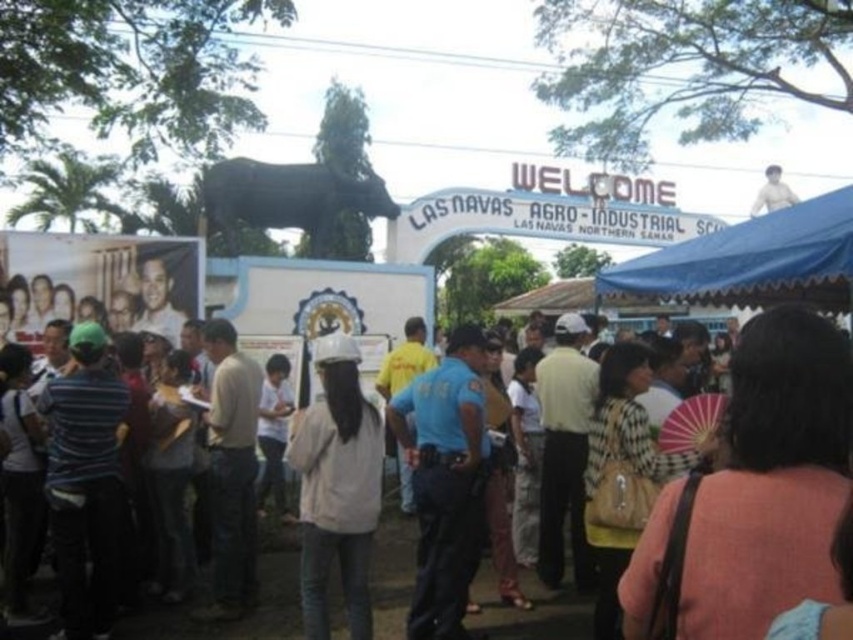
Question: Which of the following is the closest to the observer?

Choices:
 (A) (305, 416)
 (B) (169, 627)

Answer: (B)

Question: Is blue uniformed officer at center positioned in front of white matte hard hat at center?

Choices:
 (A) no
 (B) yes

Answer: (A)

Question: Is blue uniformed officer at center smaller than blue fabric canopy at upper right?

Choices:
 (A) no
 (B) yes

Answer: (B)

Question: Which point is farther from the camera taking this photo?

Choices:
 (A) (252, 220)
 (B) (344, 356)
 (C) (461, 337)
 (D) (788, 296)

Answer: (A)

Question: Considering the real-world distances, which object is farthest from the blue uniformed officer at center?

Choices:
 (A) white matte hard hat at center
 (B) blue fabric canopy at upper right
 (C) black matte statue at upper center
 (D) white hard hat at center

Answer: (B)

Question: Does white hard hat at center appear over black matte statue at upper center?

Choices:
 (A) yes
 (B) no

Answer: (B)